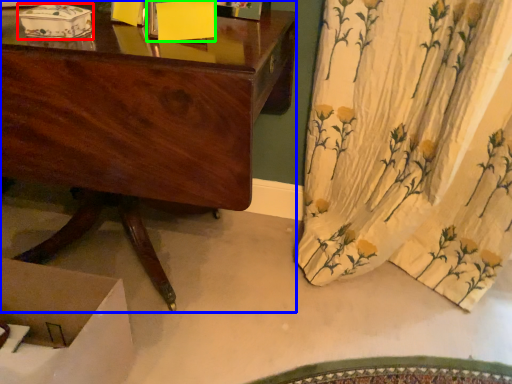
Question: Which object is the closest to the box (highlighted by a red box)? Choose among these: desk (highlighted by a blue box) or box (highlighted by a green box).

Choices:
 (A) desk
 (B) box

Answer: (B)